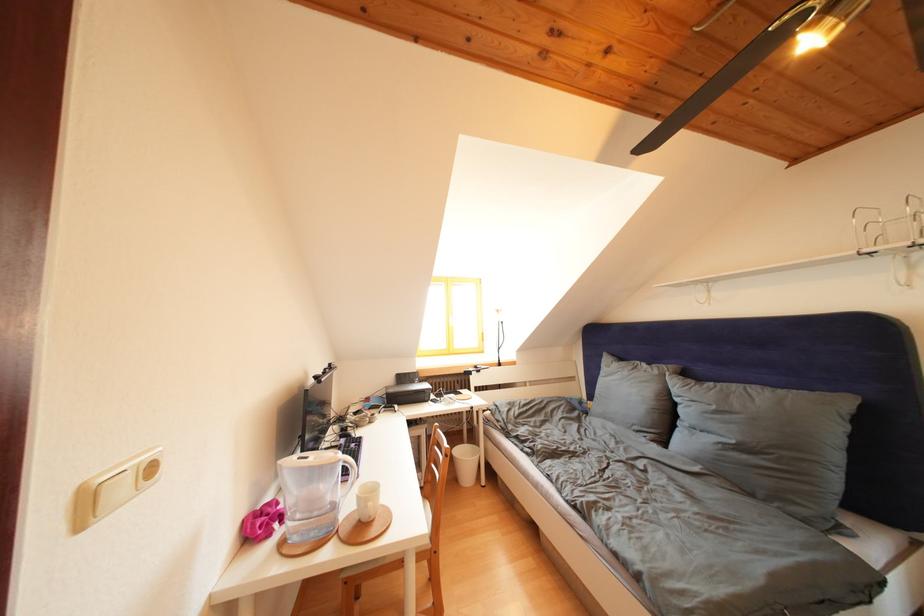
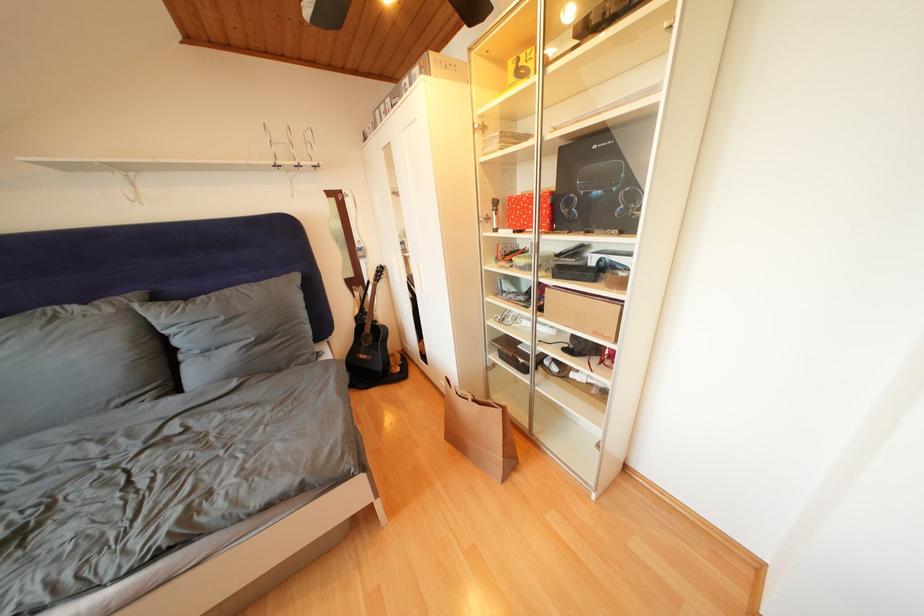
Based on the continuous images, in which direction is the camera rotating?

The camera's rotation is toward right-down.